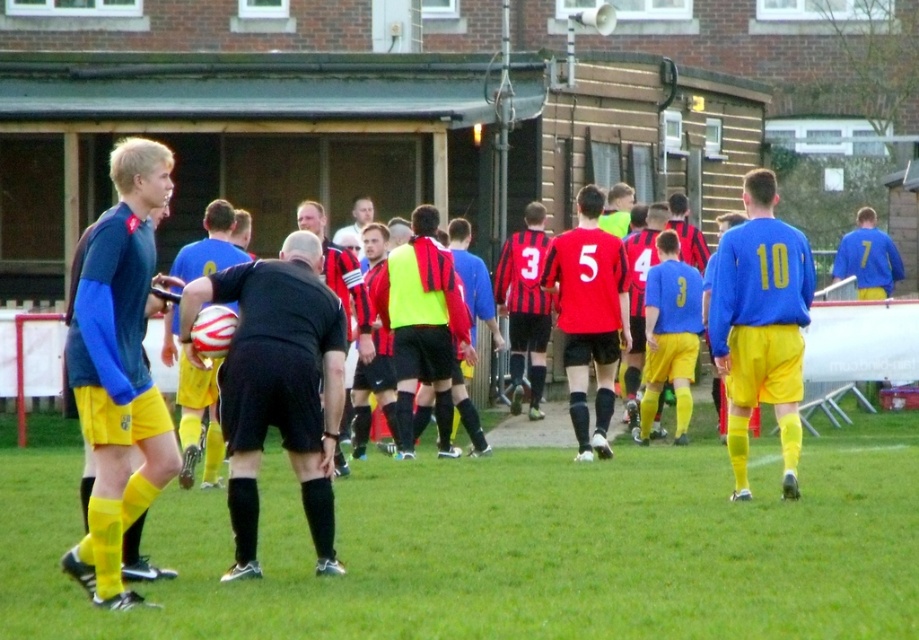
Who is higher up, yellow matte shorts at center or matte blue shirt at left?

Positioned higher is matte blue shirt at left.

Does point (336, 348) come closer to viewer compared to point (129, 280)?

No, (336, 348) is behind (129, 280).

Who is more distant from viewer, (125, 531) or (151, 412)?

Point (125, 531)

Find the location of a particular element. This screenshot has width=919, height=640. yellow matte shorts at center is located at coordinates (197, 368).

Between black matte referee at center and red and black striped jersey at center, which one is positioned higher?

red and black striped jersey at center is higher up.

Find the location of a particular element. The image size is (919, 640). black matte referee at center is located at coordinates (x=278, y=385).

The width and height of the screenshot is (919, 640). I want to click on black matte referee at center, so click(278, 385).

Between neon yellow vest at center and matte black soccer ball at center, which one appears on the right side from the viewer's perspective?

neon yellow vest at center

The image size is (919, 640). Identify the location of neon yellow vest at center. (422, 326).

Identify the location of neon yellow vest at center. Image resolution: width=919 pixels, height=640 pixels. (422, 326).